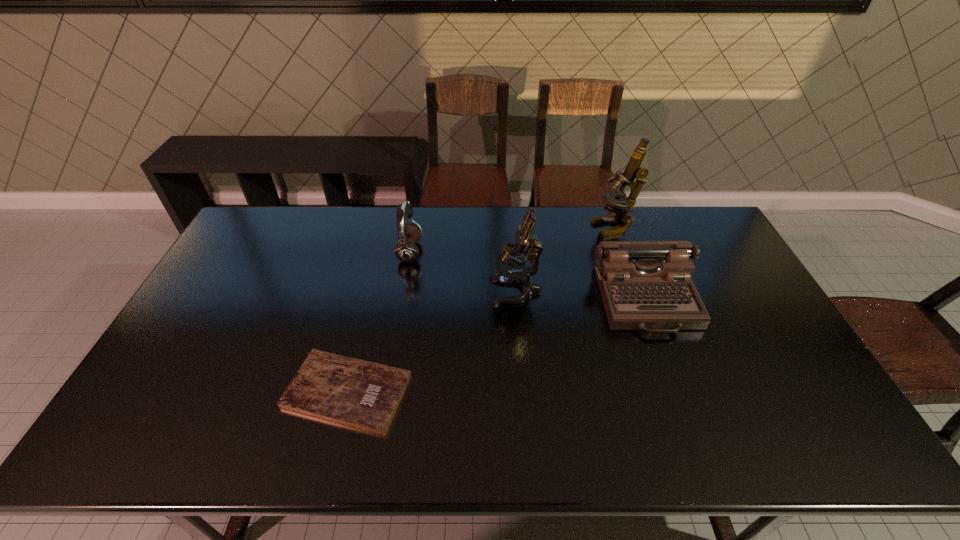
Where is `the right microscope`? Image resolution: width=960 pixels, height=540 pixels. the right microscope is located at coordinates (617, 204).

Find the location of `the left microscope`. the left microscope is located at coordinates click(x=511, y=269).

Image resolution: width=960 pixels, height=540 pixels. What are the coordinates of `the third object from left to right` in the screenshot? It's located at (511, 269).

Locate an element on the screen. the third tallest object is located at coordinates (406, 251).

The width and height of the screenshot is (960, 540). I want to click on typewriter, so click(645, 285).

The height and width of the screenshot is (540, 960). Find the location of `Bible`. Bible is located at coordinates coord(361,394).

Image resolution: width=960 pixels, height=540 pixels. I want to click on the nearest object, so 361,394.

This screenshot has width=960, height=540. Identify the location of free space located 0.170m on the left of the farther microscope. (546, 226).

Where is `vacant space located 0.160m at the eyepieces of the third object from right to left`? vacant space located 0.160m at the eyepieces of the third object from right to left is located at coordinates (439, 292).

Image resolution: width=960 pixels, height=540 pixels. Find the location of `vacant space situated 0.080m at the eyepieces of the third object from right to left`. vacant space situated 0.080m at the eyepieces of the third object from right to left is located at coordinates (465, 292).